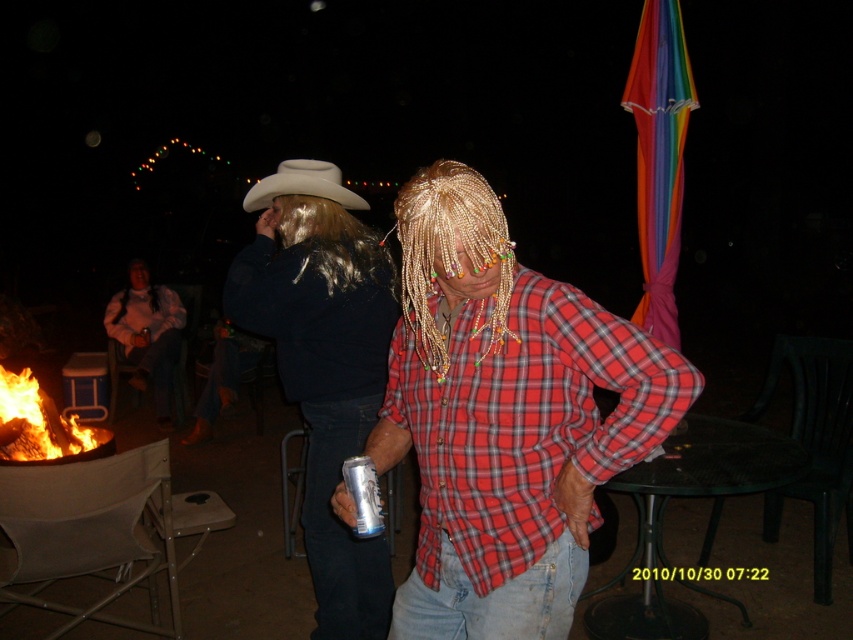
Question: Which of the following is the farthest from the observer?

Choices:
 (A) (280, 193)
 (B) (468, 480)
 (C) (379, 522)
 (D) (383, 291)

Answer: (A)

Question: Is red plaid shirt at center thinner than matte black jacket at left?

Choices:
 (A) yes
 (B) no

Answer: (A)

Question: Can you confirm if shiny brown hair at upper center is positioned to the left of matte black jacket at left?

Choices:
 (A) no
 (B) yes

Answer: (A)

Question: Which object appears farthest from the camera in this image?

Choices:
 (A) flaming wood at lower left
 (B) matte black jacket at left
 (C) shiny brown hair at upper center

Answer: (B)

Question: Is red plaid shirt at center to the left of shiny brown hair at upper center from the viewer's perspective?

Choices:
 (A) no
 (B) yes

Answer: (A)

Question: Estimate the real-world distances between objects in this image. Which object is closer to the red plaid shirt at center?

Choices:
 (A) silver metallic can at center
 (B) white felt cowboy hat at upper center

Answer: (A)